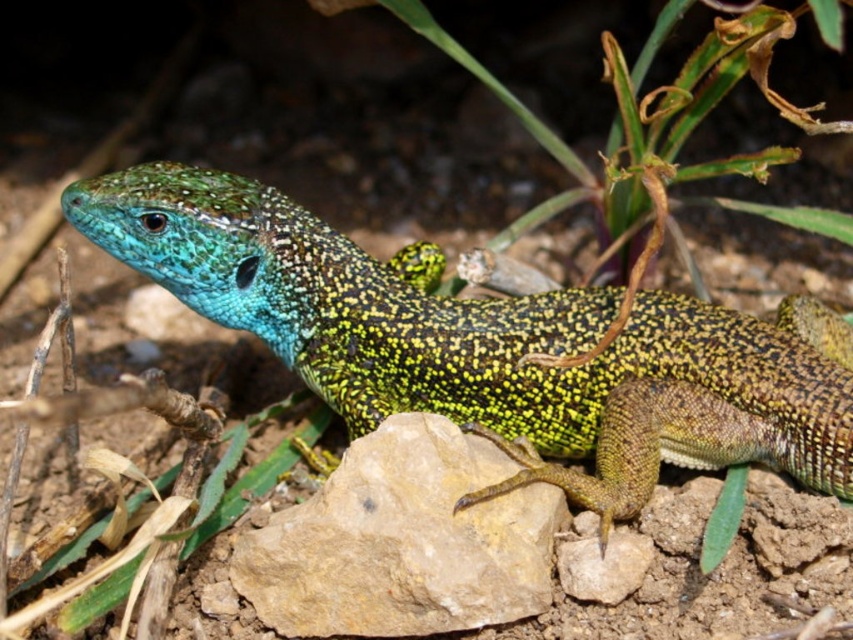
Question: Which point appears farthest from the camera in this image?

Choices:
 (A) (817, 406)
 (B) (584, 577)
 (C) (273, 586)

Answer: (A)

Question: Which object is closer to the camera taking this photo?

Choices:
 (A) smooth beige rock at center
 (B) brown rough rock at center

Answer: (B)

Question: Where is green speckled lizard at center located in relation to brown rough rock at center in the image?

Choices:
 (A) right
 (B) left

Answer: (A)

Question: Can you confirm if green speckled lizard at center is thinner than brown rough rock at center?

Choices:
 (A) no
 (B) yes

Answer: (A)

Question: Does green speckled lizard at center have a smaller size compared to smooth beige rock at center?

Choices:
 (A) no
 (B) yes

Answer: (A)

Question: Which point appears closest to the camera in this image?

Choices:
 (A) (375, 557)
 (B) (624, 570)

Answer: (A)